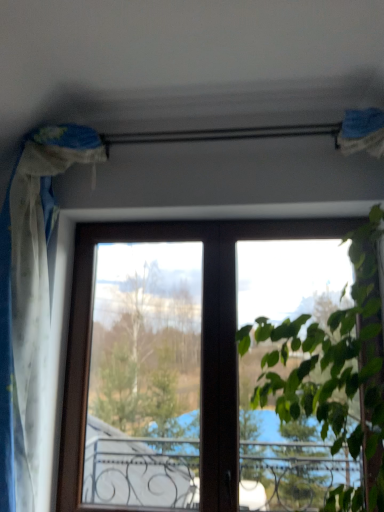
Question: Considering the relative positions of white sheer curtain at left and green leafy plant at upper right in the image provided, is white sheer curtain at left to the left or to the right of green leafy plant at upper right?

Choices:
 (A) left
 (B) right

Answer: (A)

Question: From a real-world perspective, is white sheer curtain at left physically located above or below green leafy plant at upper right?

Choices:
 (A) above
 (B) below

Answer: (A)

Question: Does point (26, 187) appear closer or farther from the camera than point (276, 266)?

Choices:
 (A) farther
 (B) closer

Answer: (B)

Question: Looking at the image, does green leafy plant at upper right seem bigger or smaller compared to white sheer curtain at left?

Choices:
 (A) small
 (B) big

Answer: (B)

Question: From their relative heights in the image, would you say green leafy plant at upper right is taller or shorter than white sheer curtain at left?

Choices:
 (A) short
 (B) tall

Answer: (A)

Question: Is green leafy plant at upper right inside or outside of white sheer curtain at left?

Choices:
 (A) outside
 (B) inside

Answer: (A)

Question: From the image's perspective, is green leafy plant at upper right located above or below white sheer curtain at left?

Choices:
 (A) below
 (B) above

Answer: (A)